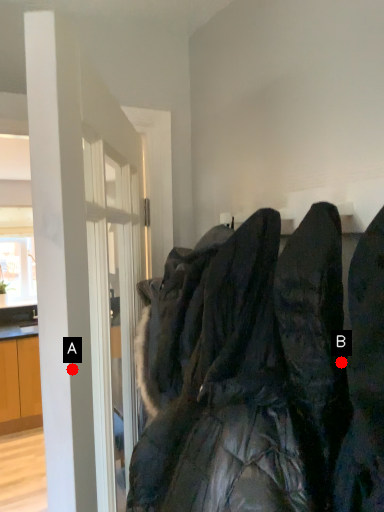
Question: Two points are circled on the image, labeled by A and B beside each circle. Which point is closer to the camera?

Choices:
 (A) A is closer
 (B) B is closer

Answer: (A)